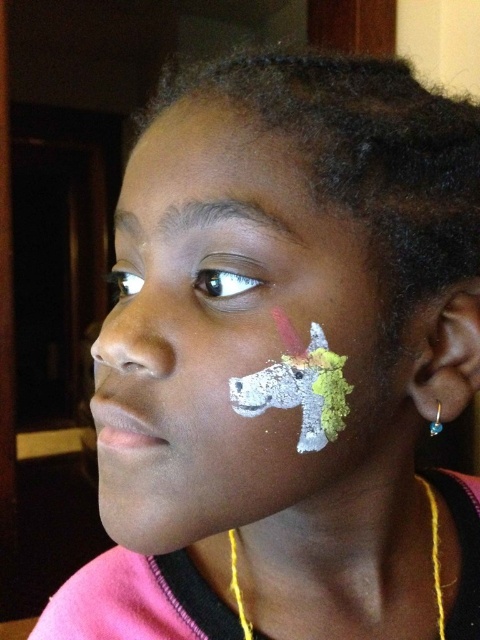
Question: Among these points, which one is nearest to the camera?

Choices:
 (A) (267, 211)
 (B) (207, 285)

Answer: (A)

Question: Based on their relative distances, which object is nearer to the glossy white eye at upper left?

Choices:
 (A) gold metallic earring at ear
 (B) matte skin at upper center
 (C) white matte unicorn face paint at lower right

Answer: (A)

Question: Can you confirm if matte white nose at upper left is positioned to the right of glossy white eye at upper left?

Choices:
 (A) no
 (B) yes

Answer: (B)

Question: Is white matte unicorn face paint at lower right to the right of matte skin at upper center from the viewer's perspective?

Choices:
 (A) no
 (B) yes

Answer: (B)

Question: Where is matte skin at upper center located in relation to matte white nose at upper left in the image?

Choices:
 (A) below
 (B) above

Answer: (B)

Question: Considering the real-world distances, which object is farthest from the gold metallic earring at ear?

Choices:
 (A) white matte unicorn face paint at lower right
 (B) glossy white eye at upper left
 (C) matte skin at upper center

Answer: (B)